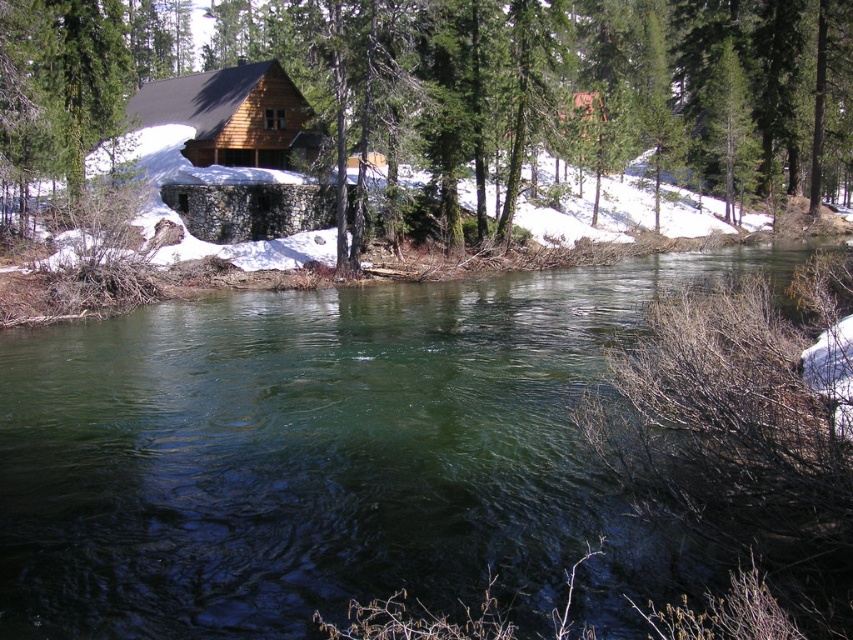
Between green leafy tree at upper center and matte wood cabin at center, which one is positioned lower?

matte wood cabin at center

From the picture: Is green leafy tree at upper center behind matte wood cabin at center?

No, green leafy tree at upper center is in front of matte wood cabin at center.

Between point (680, 163) and point (218, 86), which one is positioned in front?

Point (218, 86)

Locate an element on the screen. The image size is (853, 640). green leafy tree at upper center is located at coordinates (460, 84).

Can you confirm if green translucent water at center is positioned to the left of matte wood cabin at center?

Incorrect, green translucent water at center is not on the left side of matte wood cabin at center.

Who is more forward, (245,440) or (216,77)?

Positioned in front is point (245,440).

In order to click on green translucent water at center in this screenshot , I will do `click(322, 452)`.

Is green translucent water at center in front of green leafy tree at upper center?

Yes, green translucent water at center is in front of green leafy tree at upper center.

In the scene shown: Which is above, green translucent water at center or green leafy tree at upper center?

green leafy tree at upper center is higher up.

Find the location of `green translucent water at center`. green translucent water at center is located at coordinates click(322, 452).